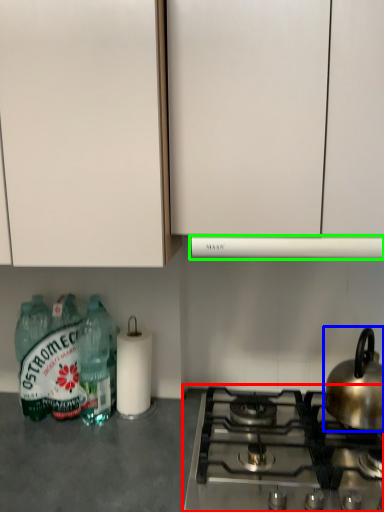
Question: Which object is positioned farthest from gas stove (highlighted by a red box)? Select from kitchen appliance (highlighted by a blue box) and vent (highlighted by a green box).

Choices:
 (A) kitchen appliance
 (B) vent

Answer: (B)